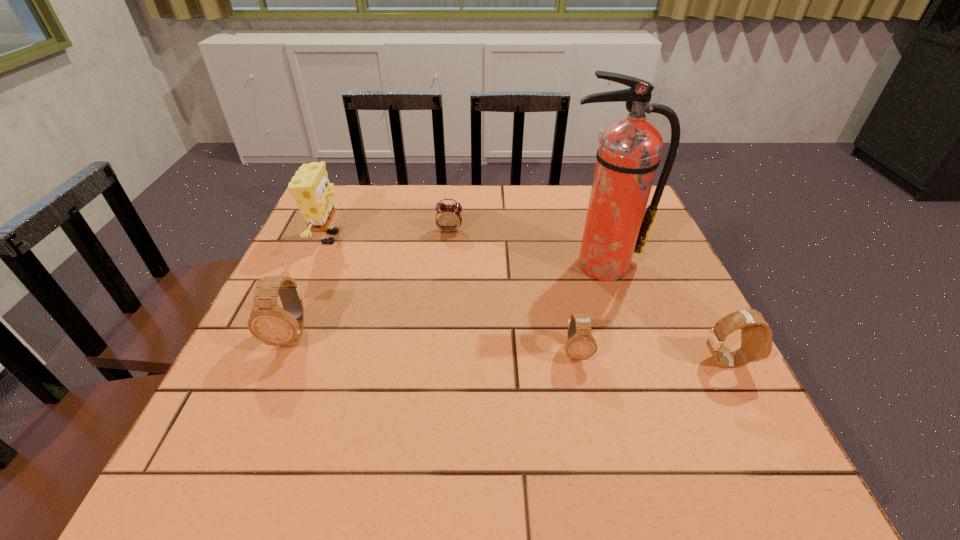
Please mark a free spot for a new watch to balance the arrangement. Please provide its 2D coordinates. Your answer should be formatted as a tuple, i.e. [(x, y)], where the tuple contains the x and y coordinates of a point satisfying the conditions above.

[(431, 344)]